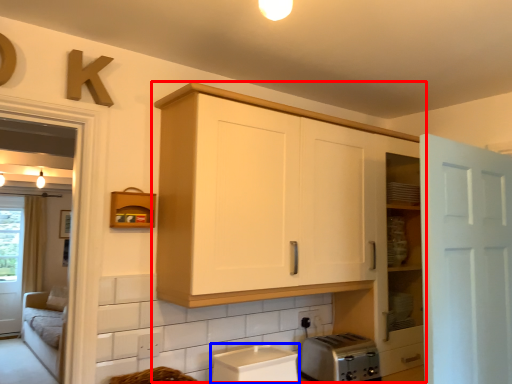
Question: Which point is closer to the camera, cabinetry (highlighted by a red box) or appliance (highlighted by a blue box)?

Choices:
 (A) cabinetry
 (B) appliance

Answer: (A)